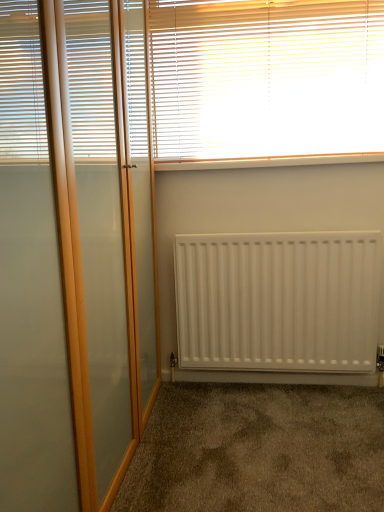
Where is `brown carpet at lower center`? This screenshot has height=512, width=384. brown carpet at lower center is located at coordinates (259, 450).

The image size is (384, 512). What do you see at coordinates (265, 78) in the screenshot?
I see `white wooden blinds at upper center` at bounding box center [265, 78].

The height and width of the screenshot is (512, 384). What do you see at coordinates (278, 301) in the screenshot? I see `white matte radiator at center` at bounding box center [278, 301].

Identify the location of brown carpet at lower center. The width and height of the screenshot is (384, 512). (259, 450).

Are white wooden blinds at upper center and brown carpet at lower center far apart?

white wooden blinds at upper center is positioned a significant distance from brown carpet at lower center.

How much distance is there between white wooden blinds at upper center and brown carpet at lower center?

They are 4.52 feet apart.

From the image's perspective, is white wooden blinds at upper center on brown carpet at lower center?

Yes, from the image's perspective, white wooden blinds at upper center is above brown carpet at lower center.

Who is taller, white wooden blinds at upper center or brown carpet at lower center?

white wooden blinds at upper center is taller.

Is there a large distance between white matte radiator at center and white plastic window sill at upper center?

white matte radiator at center is near white plastic window sill at upper center, not far away.

Measure the distance between white matte radiator at center and white plastic window sill at upper center.

The distance of white matte radiator at center from white plastic window sill at upper center is 24.36 inches.

Which object is more forward, white matte radiator at center or white plastic window sill at upper center?

white plastic window sill at upper center is more forward.

Which is in front, point (318, 79) or point (259, 166)?

The point (318, 79) is more forward.

Which object is thinner, white wooden blinds at upper center or white plastic window sill at upper center?

With smaller width is white wooden blinds at upper center.

Is white wooden blinds at upper center shorter than white plastic window sill at upper center?

No.

Measure the distance between white wooden blinds at upper center and white plastic window sill at upper center.

white wooden blinds at upper center is 11.49 inches away from white plastic window sill at upper center.

Does point (379, 160) come farther from viewer compared to point (146, 475)?

Yes, it is behind point (146, 475).

Can you confirm if white plastic window sill at upper center is smaller than brown carpet at lower center?

Yes, white plastic window sill at upper center is smaller than brown carpet at lower center.

Looking at this image, is white plastic window sill at upper center far away from brown carpet at lower center?

Indeed, white plastic window sill at upper center is not near brown carpet at lower center.

Does white plastic window sill at upper center touch white matte radiator at center?

They are not placed beside each other.

Considering the sizes of objects white plastic window sill at upper center and white matte radiator at center in the image provided, who is thinner, white plastic window sill at upper center or white matte radiator at center?

Thinner between the two is white matte radiator at center.

Is white matte radiator at center at the back of white plastic window sill at upper center?

No, white plastic window sill at upper center's orientation is not away from white matte radiator at center.

At what (x,y) coordinates should I click in order to perform the action: click on window sill above the white matte radiator at center (from the image's perspective). Please return your answer as a coordinate pair (x, y). The image size is (384, 512). Looking at the image, I should click on click(267, 162).

Based on the photo, from a real-world perspective, which is physically below, white matte radiator at center or white wooden blinds at upper center?

white matte radiator at center is physically lower.

Is white matte radiator at center at the right side of white wooden blinds at upper center?

Yes.

Locate an element on the screen. This screenshot has width=384, height=512. window blind above the white matte radiator at center (from the image's perspective) is located at coordinates (265, 78).

How many degrees apart are the facing directions of white matte radiator at center and white wooden blinds at upper center?

0.134 degrees.

Where is `radiator above the brown carpet at lower center (from the image's perspective)`? The height and width of the screenshot is (512, 384). radiator above the brown carpet at lower center (from the image's perspective) is located at coordinates (278, 301).

Between white matte radiator at center and brown carpet at lower center, which one has more height?

white matte radiator at center.

Which object is wider, white matte radiator at center or brown carpet at lower center?

Wider between the two is brown carpet at lower center.

This screenshot has height=512, width=384. I want to click on window blind to the right of brown carpet at lower center, so click(265, 78).

In the image, there is a white plastic window sill at upper center. At what (x,y) coordinates should I click in order to perform the action: click on radiator below it (from a real-world perspective). Please return your answer as a coordinate pair (x, y). The image size is (384, 512). Looking at the image, I should click on (278, 301).

Which object lies further to the anchor point white plastic window sill at upper center, white wooden blinds at upper center or white matte radiator at center?

The object further to white plastic window sill at upper center is white matte radiator at center.

From the image, which object appears to be farther from white plastic window sill at upper center, brown carpet at lower center or white matte radiator at center?

Based on the image, brown carpet at lower center appears to be further to white plastic window sill at upper center.

From the image, which object appears to be farther from white matte radiator at center, brown carpet at lower center or white plastic window sill at upper center?

Among the two, white plastic window sill at upper center is located further to white matte radiator at center.

Considering their positions, is white plastic window sill at upper center positioned closer to white matte radiator at center than white wooden blinds at upper center?

Based on the image, white plastic window sill at upper center appears to be nearer to white matte radiator at center.

From the image, which object appears to be farther from white plastic window sill at upper center, white matte radiator at center or white wooden blinds at upper center?

Based on the image, white matte radiator at center appears to be further to white plastic window sill at upper center.

Estimate the real-world distances between objects in this image. Which object is closer to white plastic window sill at upper center, white matte radiator at center or brown carpet at lower center?

white matte radiator at center.

Based on their spatial positions, is white wooden blinds at upper center or white matte radiator at center closer to brown carpet at lower center?

white matte radiator at center is closer to brown carpet at lower center.

From the image, which object appears to be farther from white wooden blinds at upper center, white matte radiator at center or brown carpet at lower center?

The object further to white wooden blinds at upper center is brown carpet at lower center.

Identify the location of window sill between white wooden blinds at upper center and white matte radiator at center vertically. This screenshot has width=384, height=512. (267, 162).

Image resolution: width=384 pixels, height=512 pixels. I want to click on radiator between white plastic window sill at upper center and brown carpet at lower center in the vertical direction, so click(x=278, y=301).

You are a GUI agent. You are given a task and a screenshot of the screen. Output one action in this format:
    pyautogui.click(x=<x>, y=<y>)
    Task: Click on the window sill between white wooden blinds at upper center and brown carpet at lower center vertically
    Image resolution: width=384 pixels, height=512 pixels.
    Given the screenshot: What is the action you would take?
    pyautogui.click(x=267, y=162)

What are the coordinates of `radiator between white wooden blinds at upper center and brown carpet at lower center from top to bottom` in the screenshot? It's located at (278, 301).